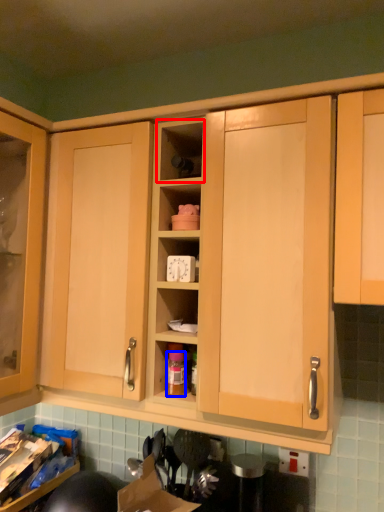
Question: Which object is further to the camera taking this photo, shelf (highlighted by a red box) or bottle (highlighted by a blue box)?

Choices:
 (A) shelf
 (B) bottle

Answer: (B)